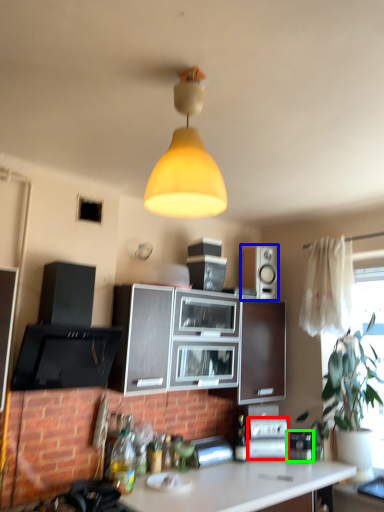
Question: Estimate the real-world distances between objects in this image. Which object is closer to appliance (highlighted by a red box), loudspeaker (highlighted by a blue box) or appliance (highlighted by a green box)?

Choices:
 (A) loudspeaker
 (B) appliance

Answer: (B)